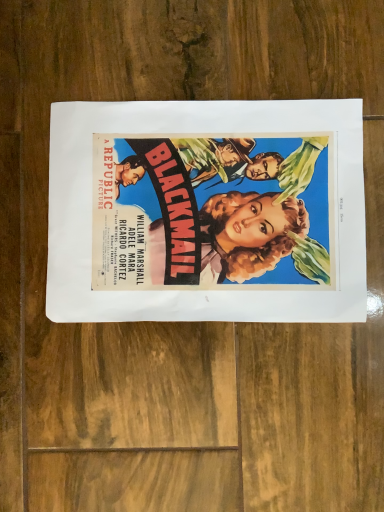
Question: Should I look upward or downward to see matte paper poster at center?

Choices:
 (A) down
 (B) up

Answer: (B)